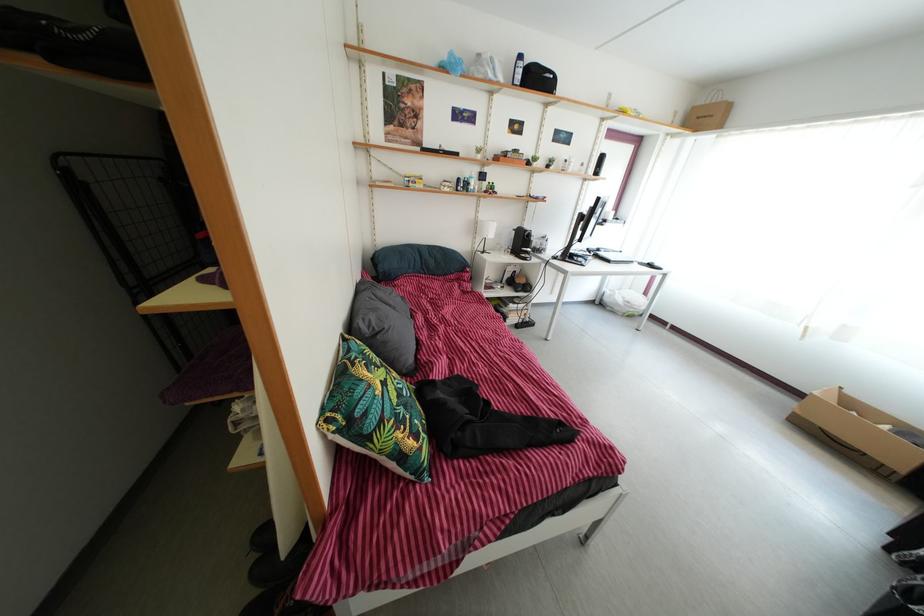
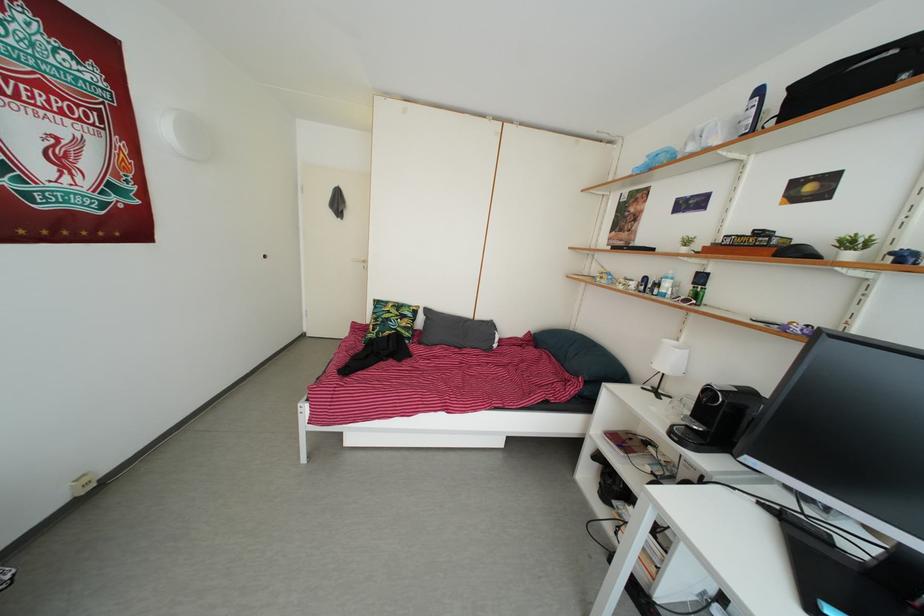
The point at [456,196] is marked in the first image. Where is the corresponding point in the second image?

(630, 293)